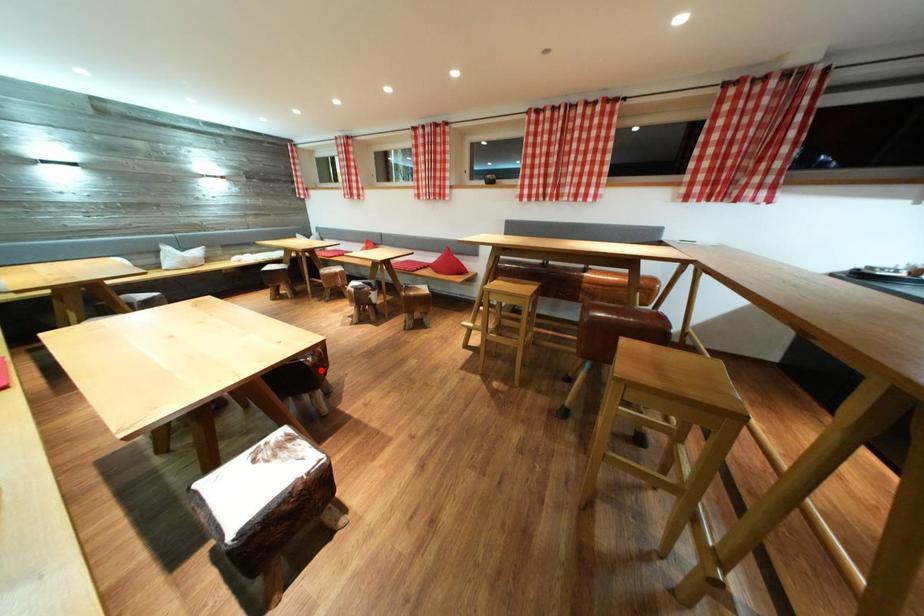
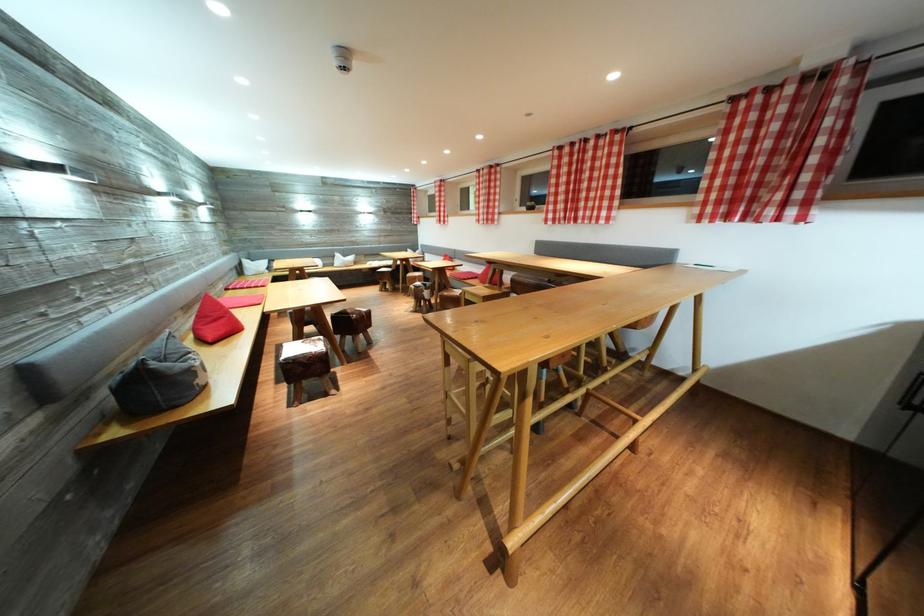
Question: I am providing you with two images of the same scene from different viewpoints. In image1, a red point is highlighted. Considering the same 3D point in image2, which of the following is correct?

Choices:
 (A) It is closer
 (B) It is farther

Answer: (B)